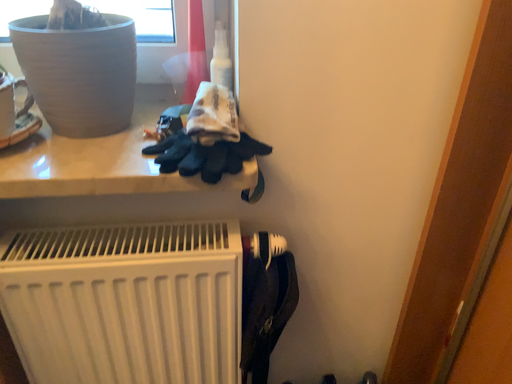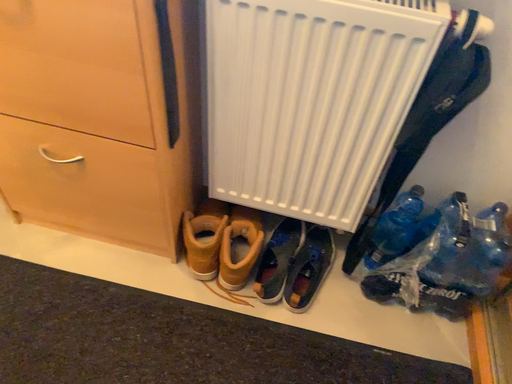
Question: How did the camera likely rotate when shooting the video?

Choices:
 (A) rotated right
 (B) rotated left

Answer: (B)